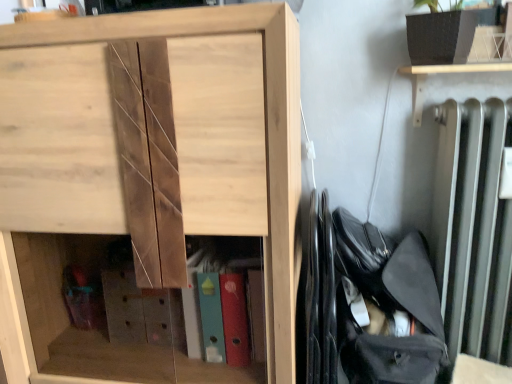
Question: From the image's perspective, is natural wood cabinet at center above or below black fabric bag at right?

Choices:
 (A) below
 (B) above

Answer: (B)

Question: From a real-world perspective, is natural wood cabinet at center positioned above or below black fabric bag at right?

Choices:
 (A) below
 (B) above

Answer: (B)

Question: In terms of size, does natural wood cabinet at center appear bigger or smaller than black fabric bag at right?

Choices:
 (A) big
 (B) small

Answer: (A)

Question: From their relative heights in the image, would you say black fabric bag at right is taller or shorter than natural wood cabinet at center?

Choices:
 (A) short
 (B) tall

Answer: (A)

Question: Is black fabric bag at right bigger or smaller than natural wood cabinet at center?

Choices:
 (A) big
 (B) small

Answer: (B)

Question: Do you think black fabric bag at right is within natural wood cabinet at center, or outside of it?

Choices:
 (A) outside
 (B) inside

Answer: (A)

Question: In terms of width, does black fabric bag at right look wider or thinner when compared to natural wood cabinet at center?

Choices:
 (A) wide
 (B) thin

Answer: (B)